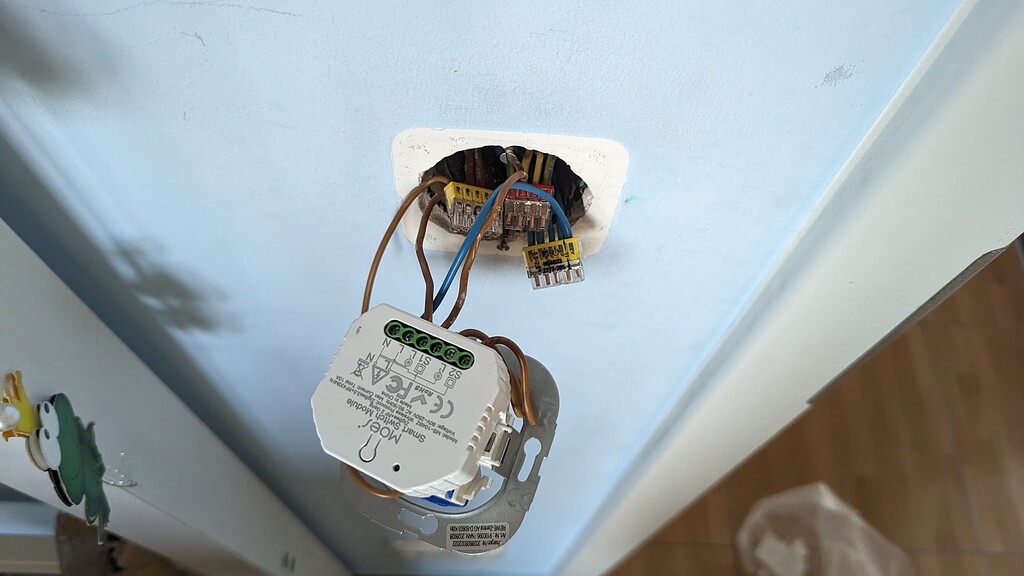
At what (x,y) coordinates should I click in order to perform the action: click on black wire. Please return your answer as a coordinate pair (x, y). The height and width of the screenshot is (576, 1024). Looking at the image, I should click on (433, 265).